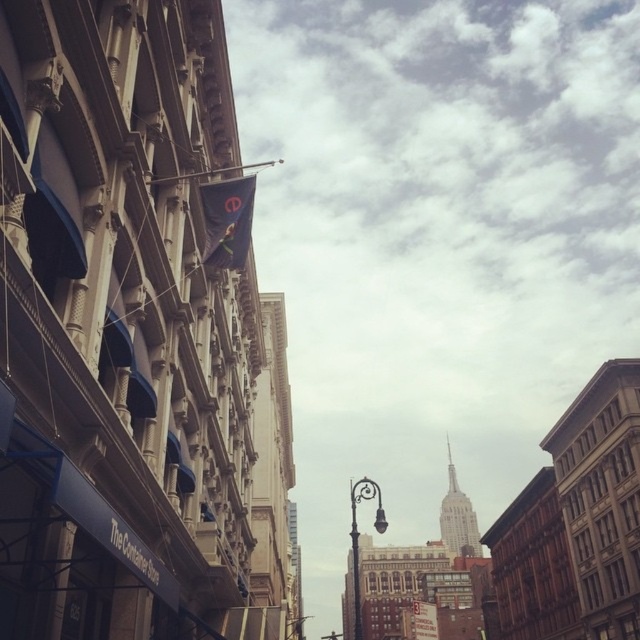
You are standing on the street looking at the Empire State Building in the background. There are two points marked on the image at coordinates point [234,257] and point [380,516]. Which point is closer to you?

Point [380,516] is closer to you because it is less further to the camera than point [234,257].

You are standing at point A located at coordinates point A at (211, 248). You want to walk to point B which is 46.20 meters away. Given the street layout shown, is there a direct path between point A and point B without crossing any obstacles?

The points are 46.20 meters apart, but the street layout with buildings and lampposts may block the direct path. However, since the description doesn not mention any obstacles between them, it is possible there is a clear path.

You are a city planner assessing the street layout. You notice the dark blue fabric flag at upper center and the metallic flagpole at upper center. Which object takes up more space in the scene?

The metallic flagpole at upper center takes up more space in the scene than the dark blue fabric flag at upper center because the dark blue fabric flag at upper center has a smaller size compared to the metallic flagpole at upper center.